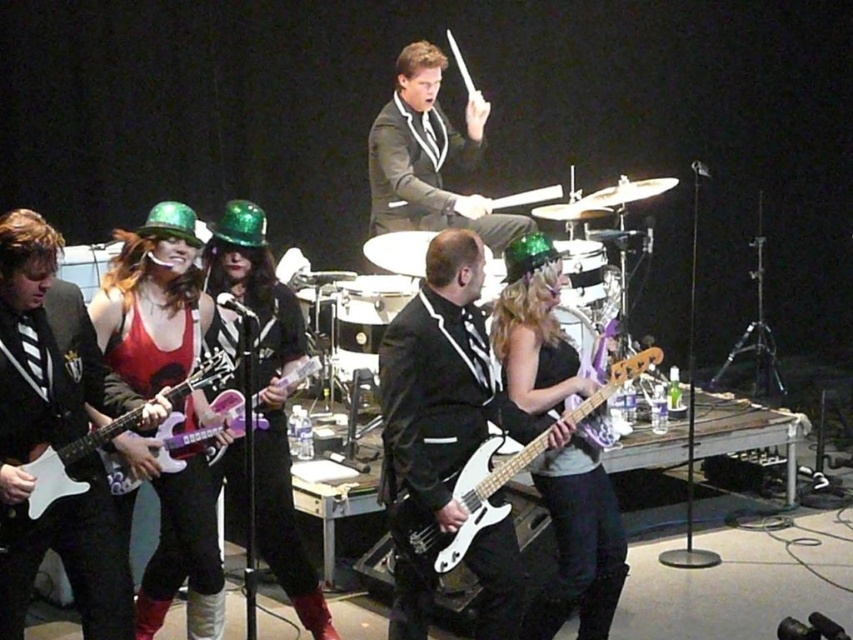
Does shiny purple guitar at center have a larger size compared to shiny silver drum at center?

Indeed, shiny purple guitar at center has a larger size compared to shiny silver drum at center.

Consider the image. Does shiny purple guitar at center appear over shiny silver drum at center?

No.

Who is more distant from viewer, [189,618] or [601,266]?

Point [601,266]

Image resolution: width=853 pixels, height=640 pixels. I want to click on shiny purple guitar at center, so click(x=154, y=301).

Between purple glossy electric guitar at center and shiny silver drum at center, which one has less height?

Standing shorter between the two is shiny silver drum at center.

Is purple glossy electric guitar at center positioned before shiny silver drum at center?

Yes, purple glossy electric guitar at center is in front of shiny silver drum at center.

This screenshot has width=853, height=640. Identify the location of purple glossy electric guitar at center. (196, 429).

Is white glossy bass guitar at center bigger than purple glossy electric guitar at center?

Indeed, white glossy bass guitar at center has a larger size compared to purple glossy electric guitar at center.

Between point (402, 513) and point (108, 481), which one is positioned behind?

Point (108, 481)

In order to click on white glossy bass guitar at center in this screenshot , I will do `click(463, 506)`.

Find the location of `white glossy bass guitar at center`. white glossy bass guitar at center is located at coordinates (463, 506).